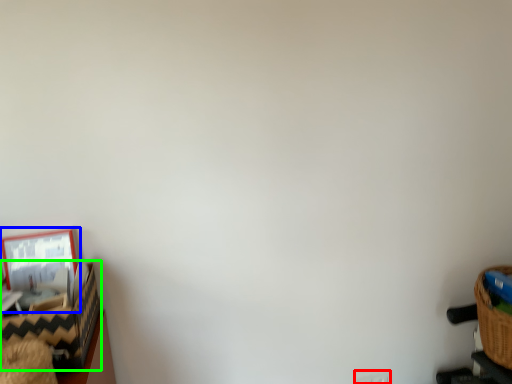
Question: Which is farther away from electric outlet (highlighted by a red box)? picture frame (highlighted by a blue box) or basket (highlighted by a green box)?

Choices:
 (A) picture frame
 (B) basket

Answer: (A)